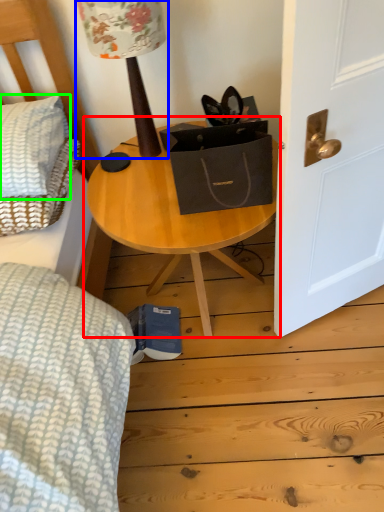
Question: Which is nearer to the table (highlighted by a red box)? table lamp (highlighted by a blue box) or pillow (highlighted by a green box).

Choices:
 (A) table lamp
 (B) pillow

Answer: (A)